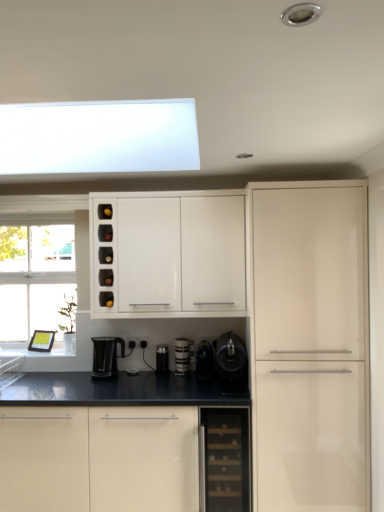
Question: Is black plastic coffee machine at center, the 1th appliance in the right-to-left sequence, inside or outside of white glossy coffee cup at center, positioned as the third appliance in right-to-left order?

Choices:
 (A) inside
 (B) outside

Answer: (B)

Question: In terms of size, does black plastic coffee machine at center, which is the 4th appliance in left-to-right order, appear bigger or smaller than white glossy coffee cup at center, acting as the second appliance starting from the left?

Choices:
 (A) small
 (B) big

Answer: (B)

Question: Which of these objects is positioned closest to the black plastic kettle at lower center?

Choices:
 (A) matte black coffee maker at center, which is counted as the first appliance, starting from the left
 (B) white glossy coffee cup at center, positioned as the third appliance in right-to-left order
 (C) white glossy cabinet at right
 (D) white glossy cabinet at upper center, the second cabinetry from the bottom
 (E) black plastic coffee maker at center, the 3th appliance in the left-to-right sequence

Answer: (A)

Question: Which is farther from the black plastic kettle at lower center?

Choices:
 (A) white glossy cabinet at lower center, marked as the 1th cabinetry in a bottom-to-top arrangement
 (B) white glossy cabinet at right
 (C) black plastic coffee maker at center, which is counted as the second appliance, starting from the right
 (D) white glossy coffee cup at center, positioned as the third appliance in right-to-left order
 (E) matte black coffee maker at center, which is counted as the first appliance, starting from the left

Answer: (B)